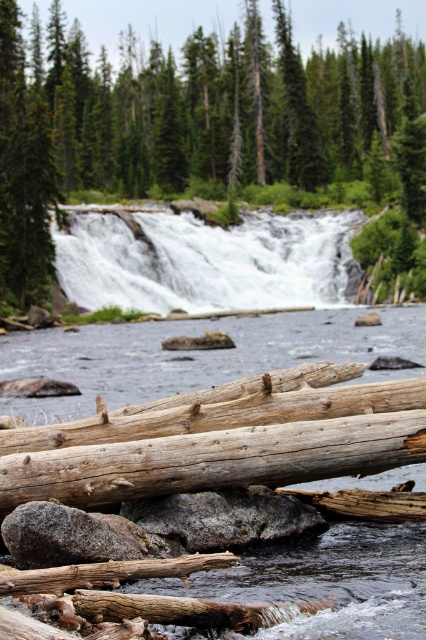
Who is more distant from viewer, (100, 61) or (181, 529)?

The point (100, 61) is behind.

Is green textured tree at upper center positioned behind rough gray rock at center?

Yes, green textured tree at upper center is further from the viewer.

Where is `green textured tree at upper center`? This screenshot has width=426, height=640. green textured tree at upper center is located at coordinates (199, 125).

Looking at this image, who is positioned more to the left, green textured tree at upper center or green matte tree at upper left?

From the viewer's perspective, green matte tree at upper left appears more on the left side.

Based on the photo, between green textured tree at upper center and green matte tree at upper left, which one appears on the right side from the viewer's perspective?

Positioned to the right is green textured tree at upper center.

The width and height of the screenshot is (426, 640). What do you see at coordinates (199, 125) in the screenshot? I see `green textured tree at upper center` at bounding box center [199, 125].

Find the location of a particular element. The height and width of the screenshot is (640, 426). green textured tree at upper center is located at coordinates (199, 125).

Between white frothy water at center and rough gray rock at center, which one appears on the right side from the viewer's perspective?

white frothy water at center is more to the right.

Can you confirm if white frothy water at center is wider than rough gray rock at center?

→ Correct, the width of white frothy water at center exceeds that of rough gray rock at center.

At what (x,y) coordinates should I click in order to perform the action: click on white frothy water at center. Please return your answer as a coordinate pair (x, y). The image size is (426, 640). Looking at the image, I should click on (207, 260).